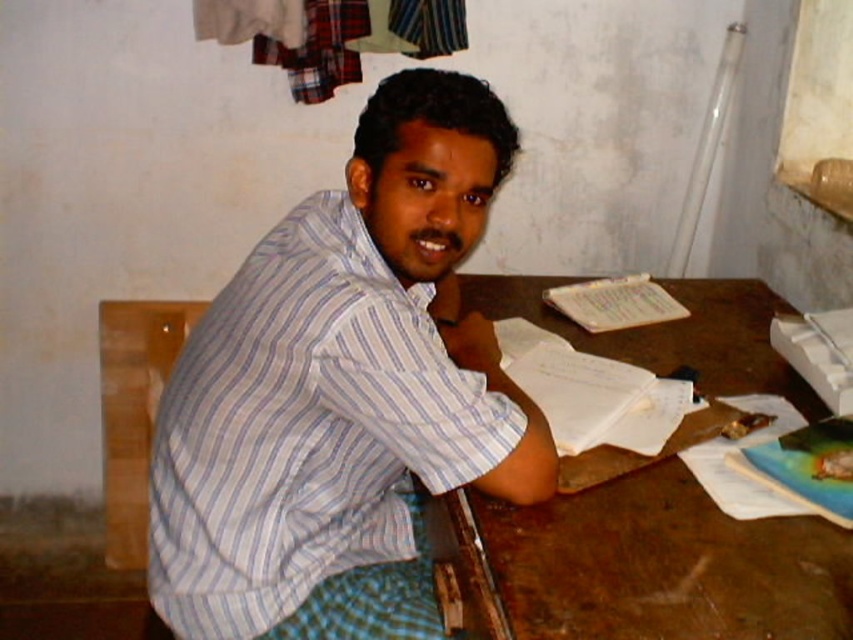
You are a photographer who needs to capture a clear shot of the white striped shirt at center and the brown wooden table at center. Which object should you focus on first if you want to ensure both are in focus without adjusting the camera settings?

The white striped shirt at center is much taller than the brown wooden table at center, so you should focus on the taller object first to ensure depth of field covers both.

What are the coordinates of the white striped shirt at center?

The white striped shirt at center is located at coordinates point (341, 378).